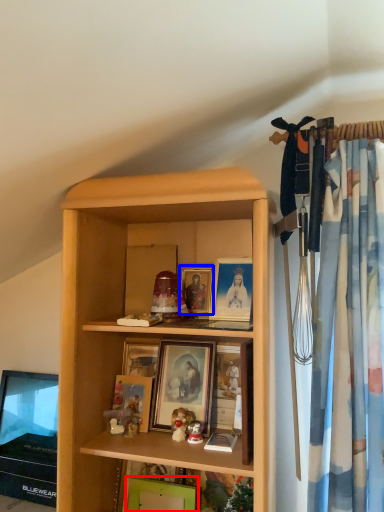
Question: Among these objects, which one is farthest to the camera, picture frame (highlighted by a red box) or picture frame (highlighted by a blue box)?

Choices:
 (A) picture frame
 (B) picture frame

Answer: (B)